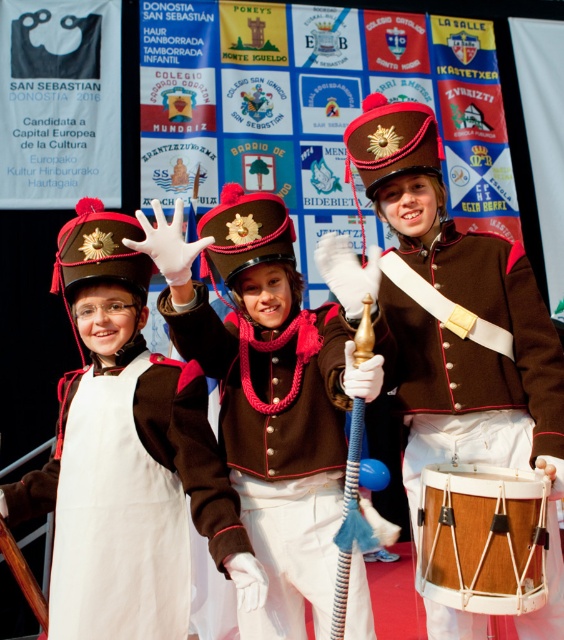
Can you confirm if brown woolen jacket at center is smaller than white felt dress at center?

No.

Does brown woolen jacket at center have a lesser height compared to white felt dress at center?

No, brown woolen jacket at center is not shorter than white felt dress at center.

Is point (274, 525) closer to viewer compared to point (29, 506)?

Yes.

This screenshot has height=640, width=564. What are the coordinates of `brown woolen jacket at center` in the screenshot? It's located at (277, 461).

Is brown matte uniform at center thinner than wooden drum at center?

No.

This screenshot has width=564, height=640. Find the location of `brown matte uniform at center`. brown matte uniform at center is located at coordinates (470, 355).

Where is `brown matte uniform at center`? brown matte uniform at center is located at coordinates (470, 355).

Between brown matte uniform at center and white felt dress at center, which one appears on the right side from the viewer's perspective?

brown matte uniform at center

Does brown matte uniform at center have a larger size compared to white felt dress at center?

Correct, brown matte uniform at center is larger in size than white felt dress at center.

You are a GUI agent. You are given a task and a screenshot of the screen. Output one action in this format:
    pyautogui.click(x=<x>, y=<y>)
    Task: Click on the brown matte uniform at center
    
    Given the screenshot: What is the action you would take?
    pyautogui.click(x=470, y=355)

What are the coordinates of `brown matte uniform at center` in the screenshot? It's located at (470, 355).